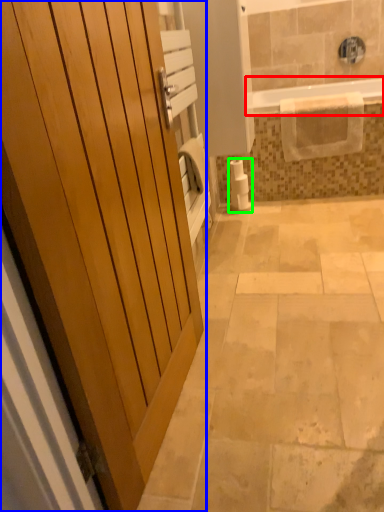
Question: Based on their relative distances, which object is farther from bathtub (highlighted by a red box)? Choose from door (highlighted by a blue box) and toilet paper (highlighted by a green box).

Choices:
 (A) door
 (B) toilet paper

Answer: (A)